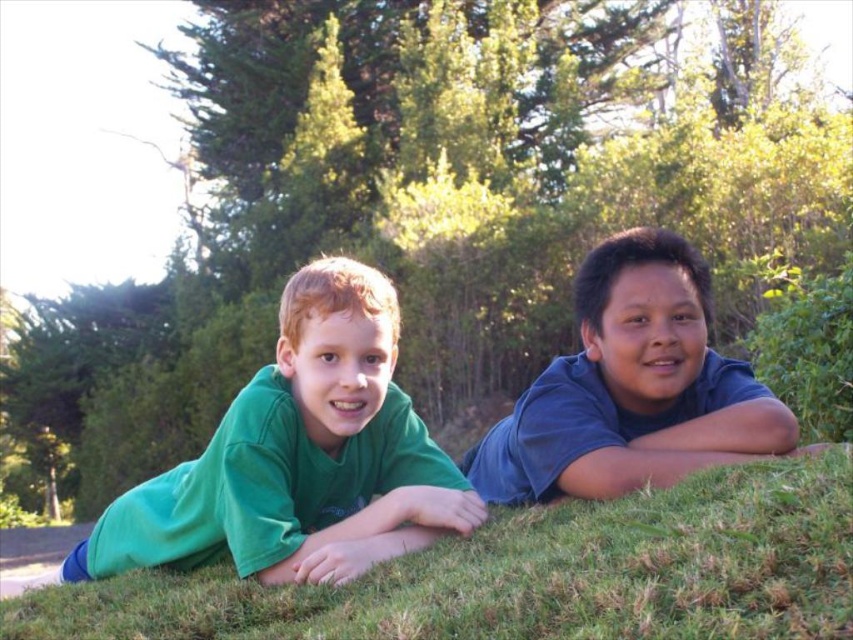
You are a photographer trying to capture a clear shot of both the green grass at lower center and the green matte shirt at left. Which object should you focus on first to ensure it appears sharp in the photo?

The green grass at lower center is closer to the viewer than the green matte shirt at left, so you should focus on the green grass at lower center first to ensure it appears sharp.

In the scene shown: You are a photographer trying to capture a closeup of the green grass at lower center. You notice the green matte shirt at left might block your view. Based on their heights, will the shirt block the grass from view?

The green grass at lower center is not as tall as the green matte shirt at left, so the shirt will block the grass from view.